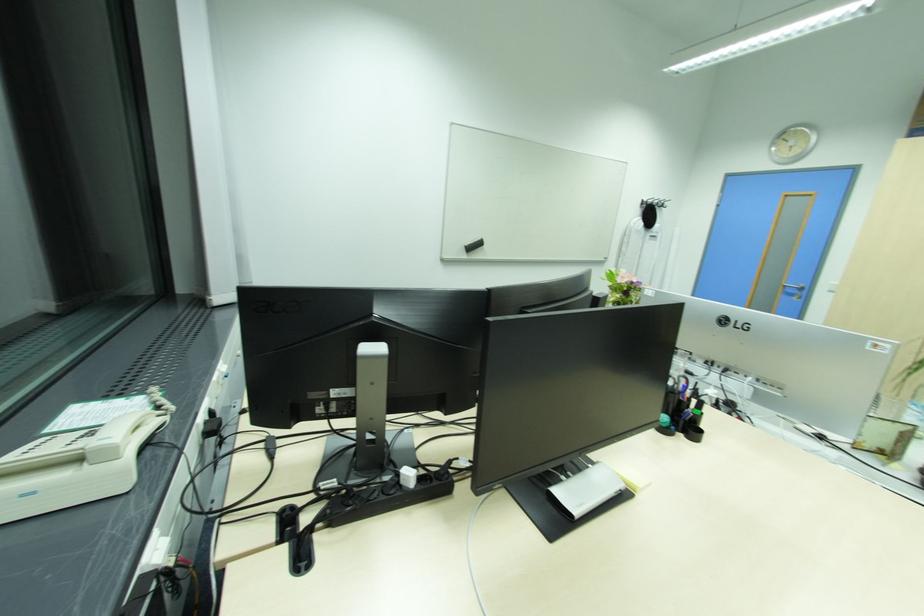
Identify the location of whiteboard eraser. (473, 245).